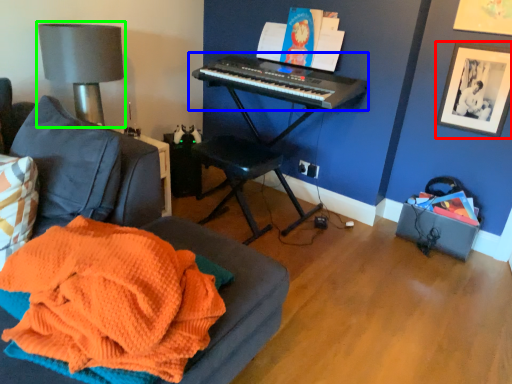
Question: Estimate the real-world distances between objects in this image. Which object is closer to picture frame (highlighted by a red box), musical keyboard (highlighted by a blue box) or table lamp (highlighted by a green box)?

Choices:
 (A) musical keyboard
 (B) table lamp

Answer: (A)